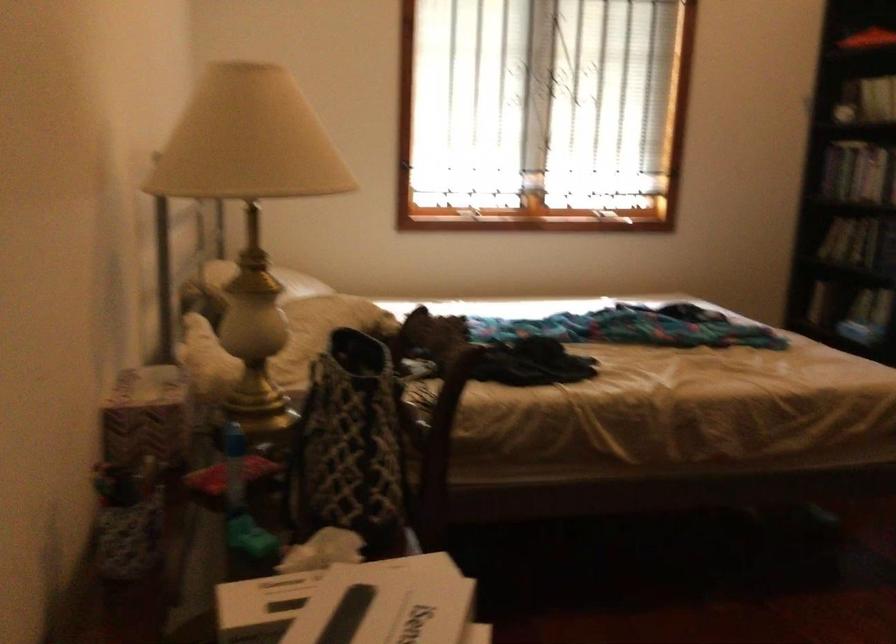
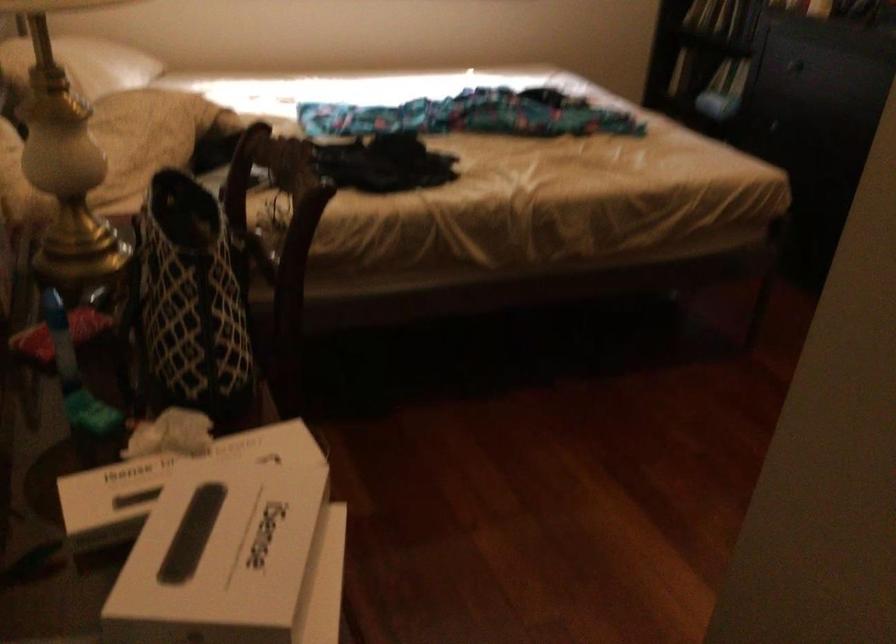
Find the pixel in the second image that matches pixel 316 574 in the first image.

(168, 477)